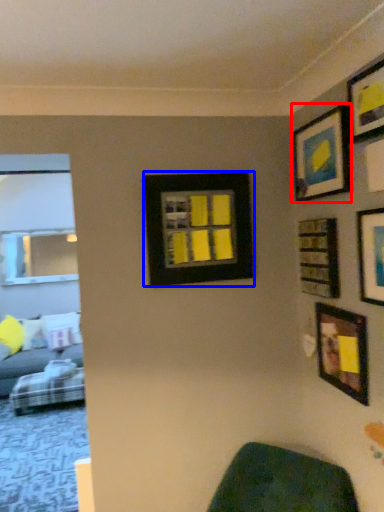
Question: Which point is closer to the camera, picture frame (highlighted by a red box) or picture frame (highlighted by a blue box)?

Choices:
 (A) picture frame
 (B) picture frame

Answer: (A)